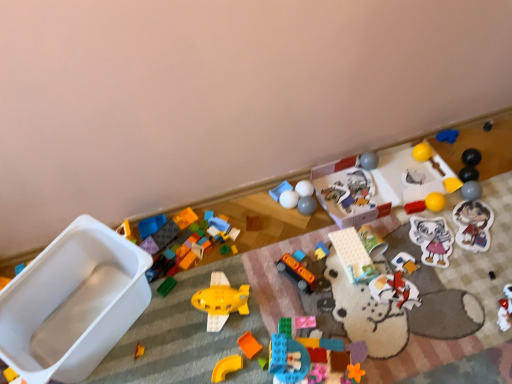
Locate an element on the screen. The width and height of the screenshot is (512, 384). free space between orange plastic block at lower left, which is the third toy in left-to-right order, and translucent plastic blocks at center, arranged as the 11th toy when viewed from the left is located at coordinates (208, 359).